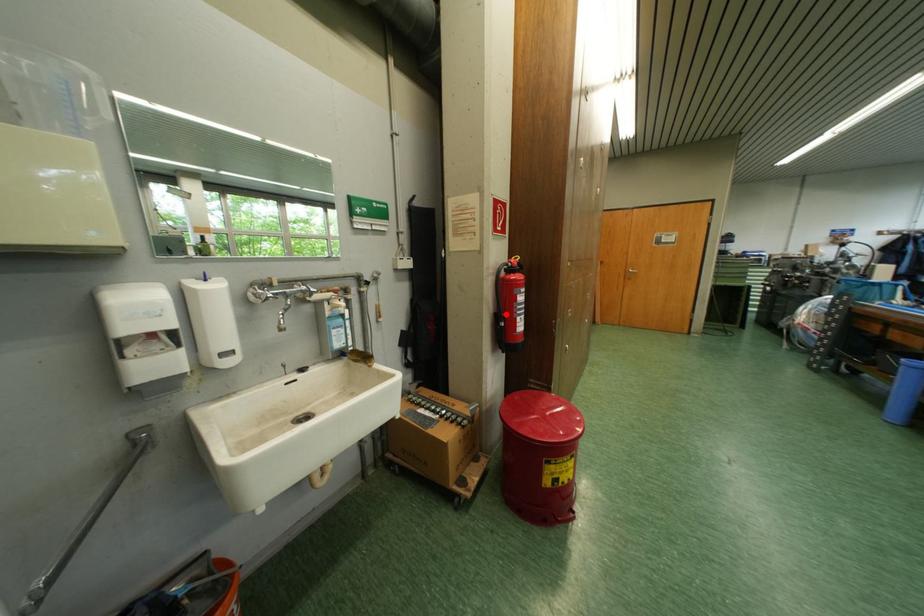
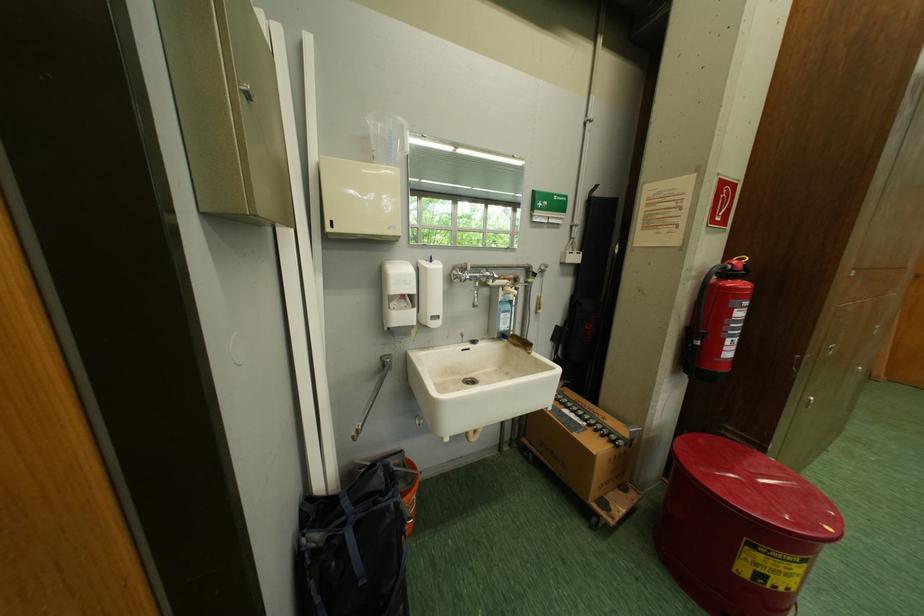
The point at the highlighted location is marked in the first image. Where is the corresponding point in the second image?

(699, 328)